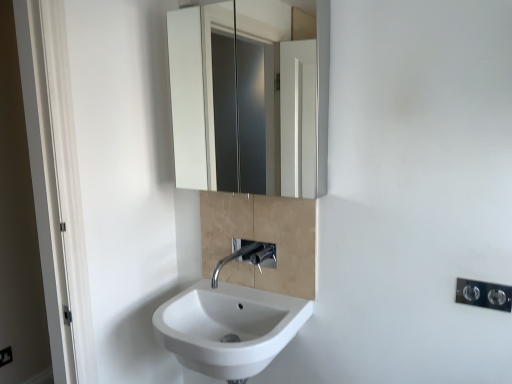
Question: From the image's perspective, is black plastic electric outlet at lower right positioned above or below polished chrome faucet at center?

Choices:
 (A) below
 (B) above

Answer: (A)

Question: From a real-world perspective, relative to polished chrome faucet at center, is black plastic electric outlet at lower right vertically above or below?

Choices:
 (A) above
 (B) below

Answer: (B)

Question: Which object is the closest to the white glossy cabinet at upper center?

Choices:
 (A) polished chrome faucet at center
 (B) polished chrome light switch at lower right
 (C) black plastic electric outlet at lower right
 (D) white glossy sink at lower center

Answer: (A)

Question: Which of these objects is positioned closest to the black plastic electric outlet at lower right?

Choices:
 (A) polished chrome light switch at lower right
 (B) white glossy cabinet at upper center
 (C) white glossy sink at lower center
 (D) polished chrome faucet at center

Answer: (C)